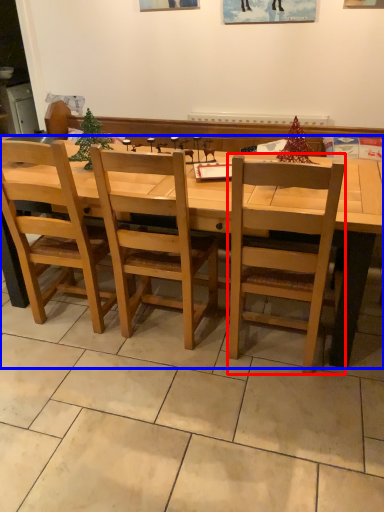
Question: Which of the following is the closest to the observer, chair (highlighted by a red box) or desk (highlighted by a blue box)?

Choices:
 (A) chair
 (B) desk

Answer: (A)